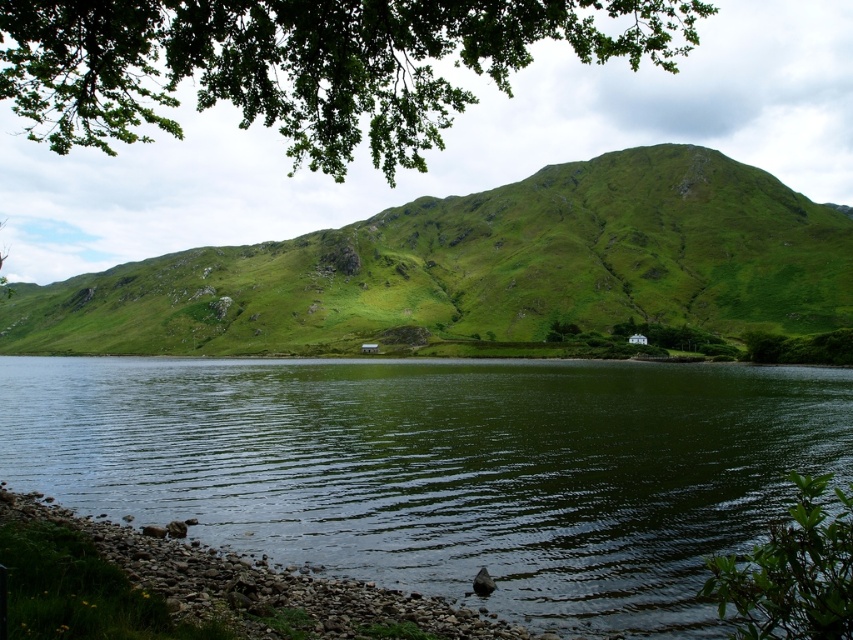
You are standing at the shoreline of the green reflective water at center and want to climb up to the green grassy hill at upper center. Which direction should you face to start your ascent?

You should face upwards from the green reflective water at center towards the green grassy hill at upper center since the hill is taller than the water area.

You are standing at the shoreline and want to walk to the green grassy hill at upper center. Which direction should you head to move away from the green reflective water at center?

You should head away from the green reflective water at center towards the green grassy hill at upper center, which is located in the upper part of the image. Since the green reflective water at center is closer to you, moving towards the upper center direction will take you away from the water and towards the hill.

Based on the photo, you are standing at the edge of the water and looking towards the green grassy hill at upper center and the green leafy tree at upper center. Which object is positioned more to your left side?

The green grassy hill at upper center is positioned to the left of the green leafy tree at upper center, so it is more to your left side.